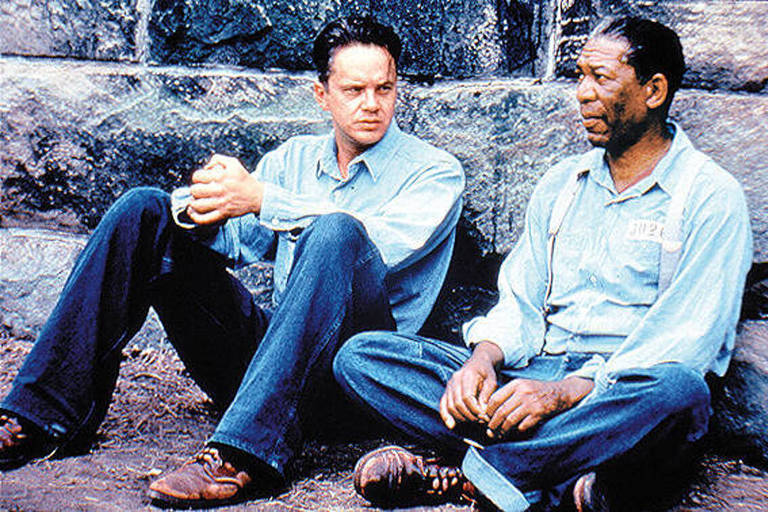
This screenshot has width=768, height=512. Find the location of `wall`. wall is located at coordinates 147,74, 746,66.